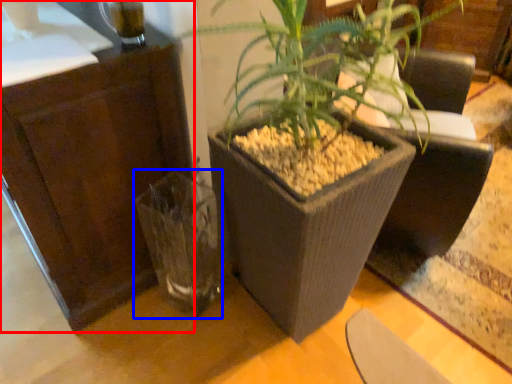
Question: Which object appears closest to the camera in this image, dresser (highlighted by a red box) or vase (highlighted by a blue box)?

Choices:
 (A) dresser
 (B) vase

Answer: (A)